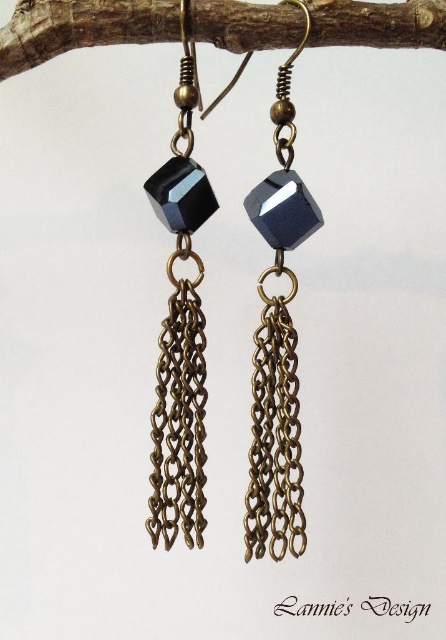
Who is positioned more to the left, brown wood at upper center or matte black cube at center?

Positioned to the left is matte black cube at center.

Is brown wood at upper center to the left of matte black cube at center from the viewer's perspective?

Incorrect, brown wood at upper center is not on the left side of matte black cube at center.

Is point (331, 42) positioned behind point (190, 465)?

That is False.

I want to click on brown wood at upper center, so click(x=81, y=28).

Does brown wood at upper center have a larger size compared to sapphire glass cube at center?

No.

Is brown wood at upper center taller than sapphire glass cube at center?

No.

Which is in front, point (226, 16) or point (280, 440)?

Positioned in front is point (226, 16).

This screenshot has height=640, width=446. What are the coordinates of `brown wood at upper center` in the screenshot? It's located at (81, 28).

Which of these two, matte black cube at center or sapphire glass cube at center, stands taller?

sapphire glass cube at center is taller.

Can you confirm if matte black cube at center is wider than sapphire glass cube at center?

No, matte black cube at center is not wider than sapphire glass cube at center.

This screenshot has height=640, width=446. What do you see at coordinates (181, 330) in the screenshot?
I see `matte black cube at center` at bounding box center [181, 330].

What are the coordinates of `matte black cube at center` in the screenshot? It's located at (181, 330).